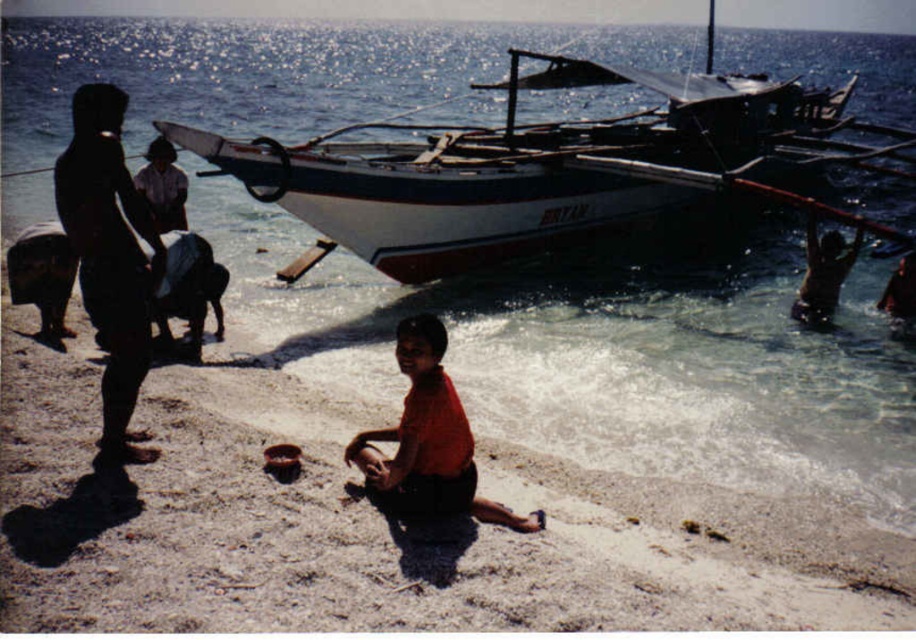
Question: Which point is farther from the camera taking this photo?

Choices:
 (A) (413, 490)
 (B) (371, 234)
 (C) (94, 148)

Answer: (B)

Question: Does white wooden boat at upper center have a greater width compared to white cotton shirt at center?

Choices:
 (A) yes
 (B) no

Answer: (A)

Question: Is dark matte clothing at left closer to the viewer compared to white cotton shirt at center?

Choices:
 (A) yes
 (B) no

Answer: (A)

Question: Which object is positioned farthest from the white cotton shirt at center?

Choices:
 (A) matte orange shirt at center
 (B) dark matte clothing at left

Answer: (A)

Question: Which of the following is the farthest from the observer?

Choices:
 (A) matte orange shirt at center
 (B) white cotton shirt at center
 (C) white wooden boat at upper center
 (D) dark matte clothing at left

Answer: (C)

Question: Can you confirm if matte orange shirt at center is smaller than white cotton shirt at center?

Choices:
 (A) no
 (B) yes

Answer: (A)